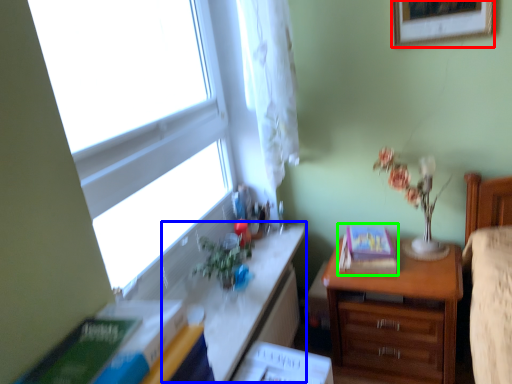
Question: Estimate the real-world distances between objects in this image. Which object is farther from picture frame (highlighted by a red box), table (highlighted by a blue box) or paperback book (highlighted by a green box)?

Choices:
 (A) table
 (B) paperback book

Answer: (A)